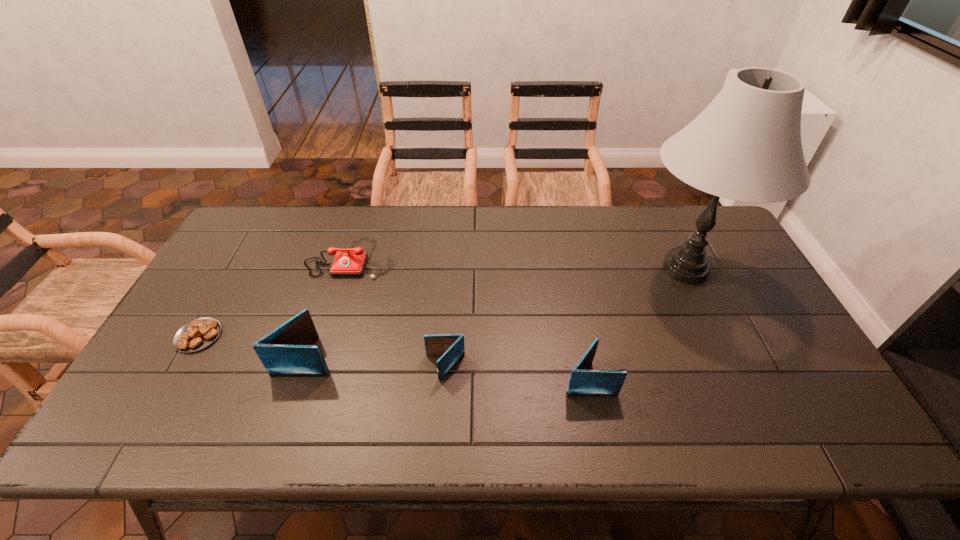
Please point out where to position a new wallet on the right to maintain spacing. Please provide its 2D coordinates. Your answer should be formatted as a tuple, i.e. [(x, y)], where the tuple contains the x and y coordinates of a point satisfying the conditions above.

[(738, 390)]